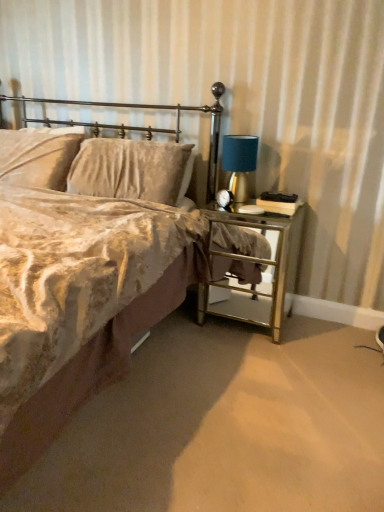
At what (x,y) coordinates should I click in order to perform the action: click on vacant space underneath blue fabric lampshade at right (from a real-world perspective). Please return your answer as a coordinate pair (x, y). This screenshot has width=384, height=512. Looking at the image, I should click on [x=246, y=196].